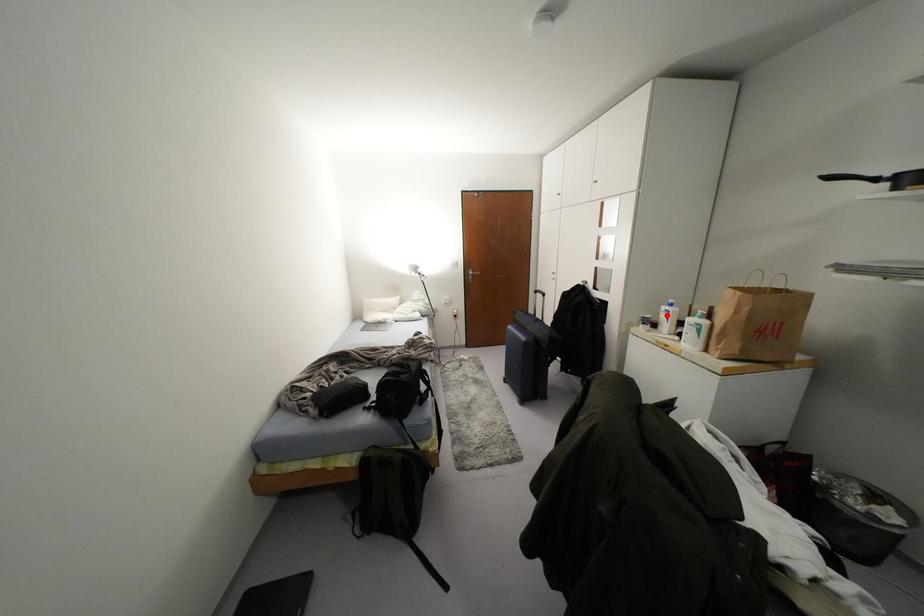
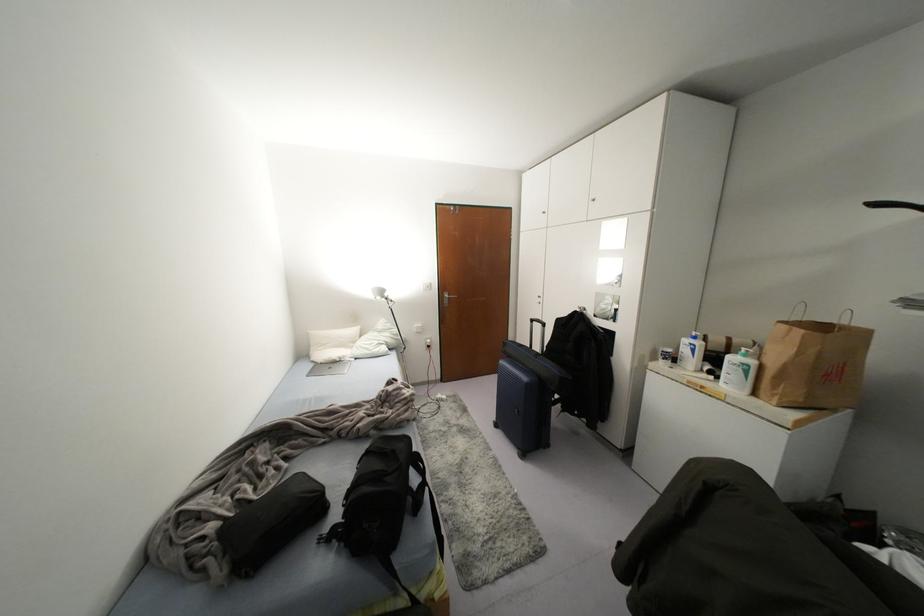
The point at the highlighted location is marked in the first image. Where is the corresponding point in the second image?

(691, 350)